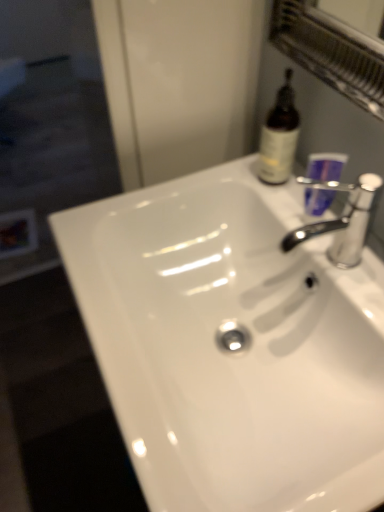
This screenshot has height=512, width=384. Identify the location of vacant space situated on the left part of brown glass bottle at upper right. (215, 177).